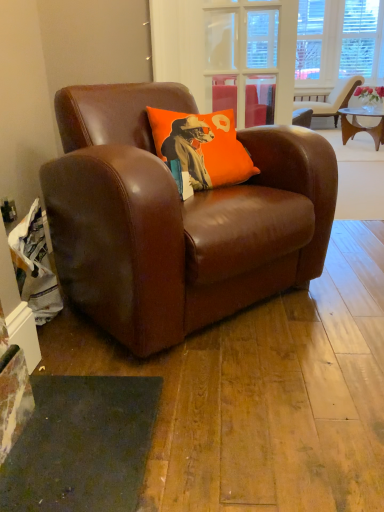
The width and height of the screenshot is (384, 512). Describe the element at coordinates (201, 147) in the screenshot. I see `orange fabric pillow at center` at that location.

Locate an element on the screen. The width and height of the screenshot is (384, 512). orange fabric pillow at center is located at coordinates (201, 147).

Would you say transparent glass door at upper center is part of orange fabric pillow at center's contents?

Definitely not — transparent glass door at upper center is not inside orange fabric pillow at center.

In the image, is orange fabric pillow at center on the left side or the right side of transparent glass door at upper center?

orange fabric pillow at center is positioned on transparent glass door at upper center's left side.

From the image's perspective, is orange fabric pillow at center located above or below transparent glass door at upper center?

orange fabric pillow at center is below transparent glass door at upper center.

Is point (202, 117) in front of point (257, 90)?

Yes, point (202, 117) is in front of point (257, 90).

Which of these two, transparent glass door at upper center or orange fabric pillow at center, is smaller?

With smaller size is transparent glass door at upper center.

From the image's perspective, does transparent glass door at upper center appear higher than orange fabric pillow at center?

Yes, from the image's perspective, transparent glass door at upper center is over orange fabric pillow at center.

Which object is thinner, transparent glass door at upper center or orange fabric pillow at center?

transparent glass door at upper center is thinner.

From a real-world perspective, which object rests below the other?

From a 3D spatial view, orange fabric pillow at center is below.

Is orange fabric pillow at center not near brown leather chair at center, which appears as the second chair when viewed from the right?

No, orange fabric pillow at center is not far away from brown leather chair at center, which appears as the second chair when viewed from the right.

Is point (186, 148) positioned before point (132, 322)?

No.

Considering the positions of objects orange fabric pillow at center and brown leather chair at center, positioned as the second chair in top-to-bottom order, in the image provided, who is behind, orange fabric pillow at center or brown leather chair at center, positioned as the second chair in top-to-bottom order,?

orange fabric pillow at center.

Could you measure the distance between orange fabric pillow at center and brown leather chair at center, which is counted as the first chair, starting from the left?

The distance of orange fabric pillow at center from brown leather chair at center, which is counted as the first chair, starting from the left, is 10.09 inches.

From the image's perspective, would you say beige leather chair at upper right, which is the 1th chair in top-to-bottom order, is shown under brown leather chair at center, which appears as the second chair when viewed from the right?

Actually, beige leather chair at upper right, which is the 1th chair in top-to-bottom order, appears above brown leather chair at center, which appears as the second chair when viewed from the right, in the image.

From the picture: Does beige leather chair at upper right, which is the 2th chair in bottom-to-top order, come behind brown leather chair at center, which is counted as the 1th chair, starting from the bottom?

Yes, beige leather chair at upper right, which is the 2th chair in bottom-to-top order, is further from the viewer.

Between beige leather chair at upper right, which is the second chair in left-to-right order, and brown leather chair at center, positioned as the 1th chair in front-to-back order, which one has larger width?

brown leather chair at center, positioned as the 1th chair in front-to-back order, is wider.

From a real-world perspective, is beige leather chair at upper right, the second chair from the front, on transparent glass door at upper center?

Incorrect, from a real-world perspective, beige leather chair at upper right, the second chair from the front, is lower than transparent glass door at upper center.

Is beige leather chair at upper right, arranged as the first chair when viewed from the back, aimed at transparent glass door at upper center?

Yes.

From the image's perspective, which is below, beige leather chair at upper right, arranged as the 1th chair when viewed from the right, or transparent glass door at upper center?

transparent glass door at upper center appears lower in the image.

Considering the relative sizes of beige leather chair at upper right, the second chair from the front, and transparent glass door at upper center in the image provided, is beige leather chair at upper right, the second chair from the front, shorter than transparent glass door at upper center?

Incorrect, the height of beige leather chair at upper right, the second chair from the front, does not fall short of that of transparent glass door at upper center.

Considering the relative sizes of transparent glass door at upper center and brown leather chair at center, which is counted as the first chair, starting from the left, in the image provided, is transparent glass door at upper center wider than brown leather chair at center, which is counted as the first chair, starting from the left,?

No, transparent glass door at upper center is not wider than brown leather chair at center, which is counted as the first chair, starting from the left.

Locate an element on the screen. This screenshot has height=512, width=384. glass door above the brown leather chair at center, positioned as the 1th chair in front-to-back order (from the image's perspective) is located at coordinates (242, 58).

Based on the photo, which is behind, brown leather chair at center, which appears as the second chair when viewed from the right, or transparent glass door at upper center?

transparent glass door at upper center is further from the camera.

From a real-world perspective, which chair is the 2nd one underneath the transparent glass door at upper center? Please provide its 2D coordinates.

[(177, 218)]

Between brown leather chair at center, which is counted as the first chair, starting from the left, and transparent glass door at upper center, which one has smaller size?

transparent glass door at upper center.

Can you confirm if brown leather chair at center, which is counted as the first chair, starting from the left, is shorter than transparent glass door at upper center?

No, brown leather chair at center, which is counted as the first chair, starting from the left, is not shorter than transparent glass door at upper center.

Find the location of a particular element. pillow in front of the transparent glass door at upper center is located at coordinates (201, 147).

Identify the location of pillow directly beneath the transparent glass door at upper center (from a real-world perspective). (201, 147).

Based on their spatial positions, is transparent glass door at upper center or orange fabric pillow at center further from beige leather chair at upper right, arranged as the 1th chair when viewed from the right?

orange fabric pillow at center is further to beige leather chair at upper right, arranged as the 1th chair when viewed from the right.

Looking at the image, which one is located further to brown leather chair at center, which appears as the second chair when viewed from the right, beige leather chair at upper right, which is the 1th chair in top-to-bottom order, or transparent glass door at upper center?

Based on the image, beige leather chair at upper right, which is the 1th chair in top-to-bottom order, appears to be further to brown leather chair at center, which appears as the second chair when viewed from the right.

From the image, which object appears to be nearer to orange fabric pillow at center, brown leather chair at center, which appears as the second chair when viewed from the right, or beige leather chair at upper right, which is the second chair in left-to-right order?

brown leather chair at center, which appears as the second chair when viewed from the right, lies closer to orange fabric pillow at center than the other object.

Which object lies nearer to the anchor point beige leather chair at upper right, which is the 1th chair in top-to-bottom order, orange fabric pillow at center or transparent glass door at upper center?

Based on the image, transparent glass door at upper center appears to be nearer to beige leather chair at upper right, which is the 1th chair in top-to-bottom order.

From the image, which object appears to be nearer to transparent glass door at upper center, brown leather chair at center, positioned as the second chair in top-to-bottom order, or orange fabric pillow at center?

orange fabric pillow at center lies closer to transparent glass door at upper center than the other object.

Considering their positions, is brown leather chair at center, which appears as the second chair when viewed from the right, positioned closer to beige leather chair at upper right, which is the 2th chair in bottom-to-top order, than transparent glass door at upper center?

transparent glass door at upper center is closer to beige leather chair at upper right, which is the 2th chair in bottom-to-top order.

Based on their spatial positions, is transparent glass door at upper center or beige leather chair at upper right, arranged as the 1th chair when viewed from the right, closer to brown leather chair at center, which appears as the second chair when viewed from the right?

The object closer to brown leather chair at center, which appears as the second chair when viewed from the right, is transparent glass door at upper center.

Which object lies further to the anchor point transparent glass door at upper center, orange fabric pillow at center or beige leather chair at upper right, which is the 2th chair in bottom-to-top order?

beige leather chair at upper right, which is the 2th chair in bottom-to-top order, is further to transparent glass door at upper center.

Where is `pillow between brown leather chair at center, positioned as the 1th chair in front-to-back order, and transparent glass door at upper center from front to back`? pillow between brown leather chair at center, positioned as the 1th chair in front-to-back order, and transparent glass door at upper center from front to back is located at coordinates (201, 147).

The image size is (384, 512). I want to click on glass door between orange fabric pillow at center and beige leather chair at upper right, which is the 2th chair in bottom-to-top order, in the front-back direction, so click(x=242, y=58).

Locate an element on the screen. The width and height of the screenshot is (384, 512). glass door between brown leather chair at center, positioned as the 1th chair in front-to-back order, and beige leather chair at upper right, the second chair from the front, along the z-axis is located at coordinates (x=242, y=58).

The image size is (384, 512). What are the coordinates of `pillow between brown leather chair at center, which is counted as the first chair, starting from the left, and beige leather chair at upper right, which is the 1th chair in top-to-bottom order, in the front-back direction` in the screenshot? It's located at (201, 147).